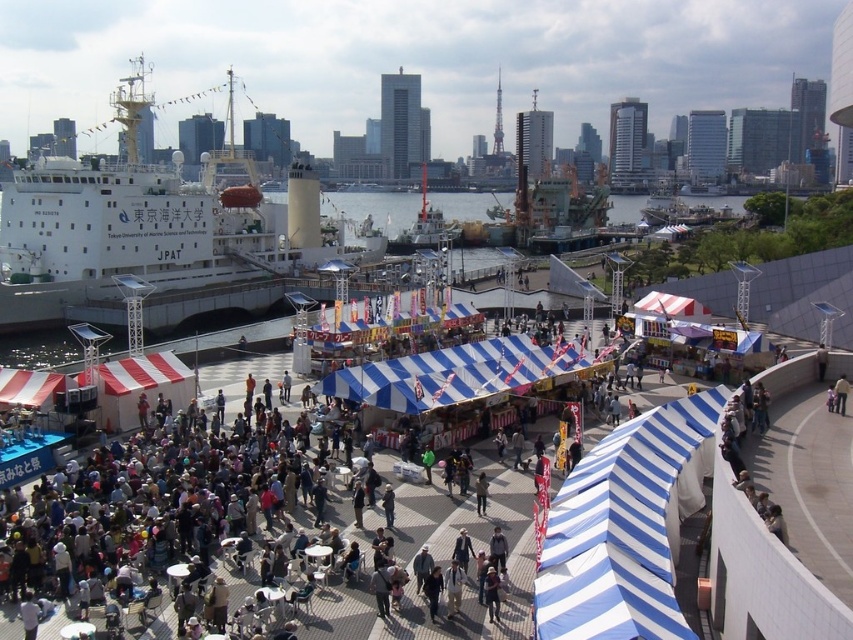
Measure the distance between point (45, 288) and camera.

103.62 meters

Can you confirm if white matte ship at left is positioned to the left of metallic gray ship at center?

Yes, white matte ship at left is to the left of metallic gray ship at center.

Find the location of `white matte ship at left`. white matte ship at left is located at coordinates (151, 225).